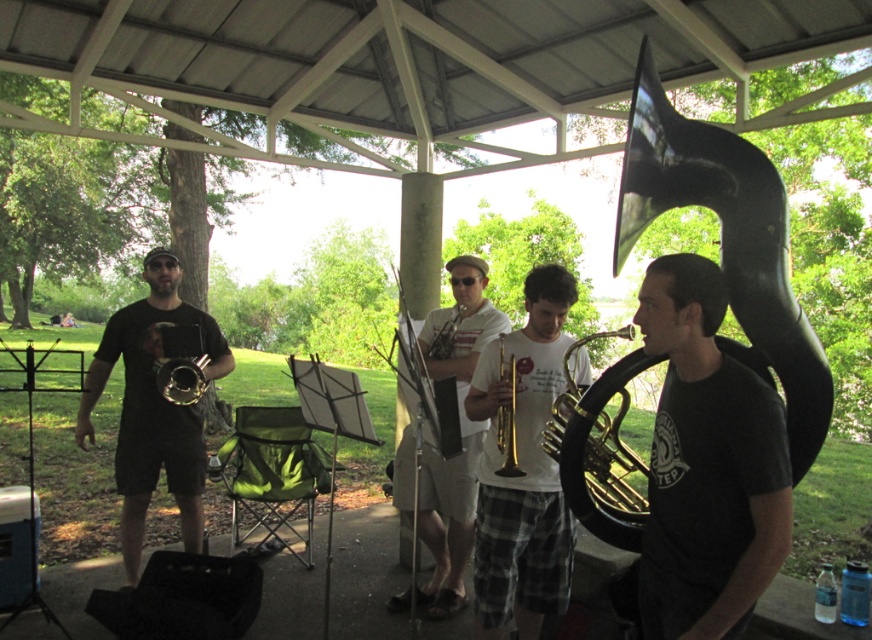
Question: Does gold brass trumpet at left have a lesser width compared to gold brass trumpet at center?

Choices:
 (A) no
 (B) yes

Answer: (A)

Question: Can you confirm if white matte shirt at center is wider than gold brass trumpet at left?

Choices:
 (A) no
 (B) yes

Answer: (B)

Question: Can you confirm if black matte tuba at right is positioned above gold brass trumpet at center?

Choices:
 (A) no
 (B) yes

Answer: (A)

Question: Which point is closer to the camera?

Choices:
 (A) (135, 332)
 (B) (509, 332)
 (C) (460, 272)

Answer: (B)

Question: Estimate the real-world distances between objects in this image. Which object is farther from the gold brass trumpet at left?

Choices:
 (A) gold brass trumpet at center
 (B) white matte shirt at center
 (C) matte black trumpet at left

Answer: (A)

Question: Which point appears farthest from the camera in this image?

Choices:
 (A) (781, 419)
 (B) (685, 189)
 (C) (157, 371)

Answer: (C)